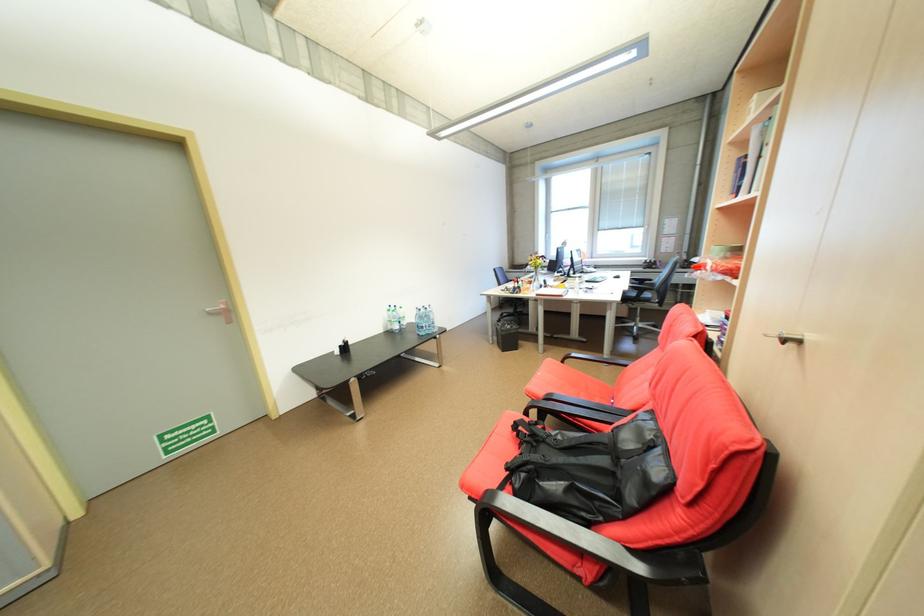
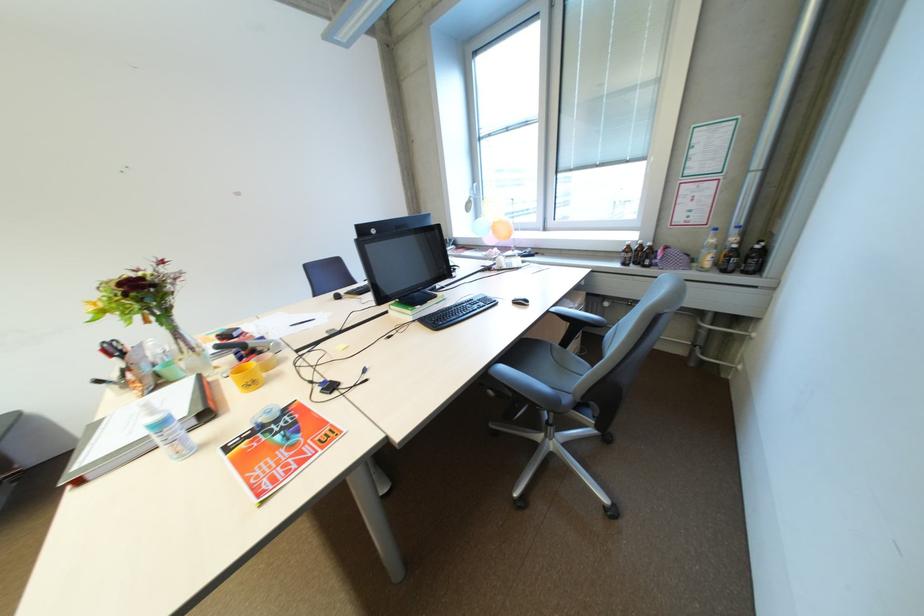
Which direction would the cameraman need to move to produce the second image?

The movement direction of the cameraman is right, forward.